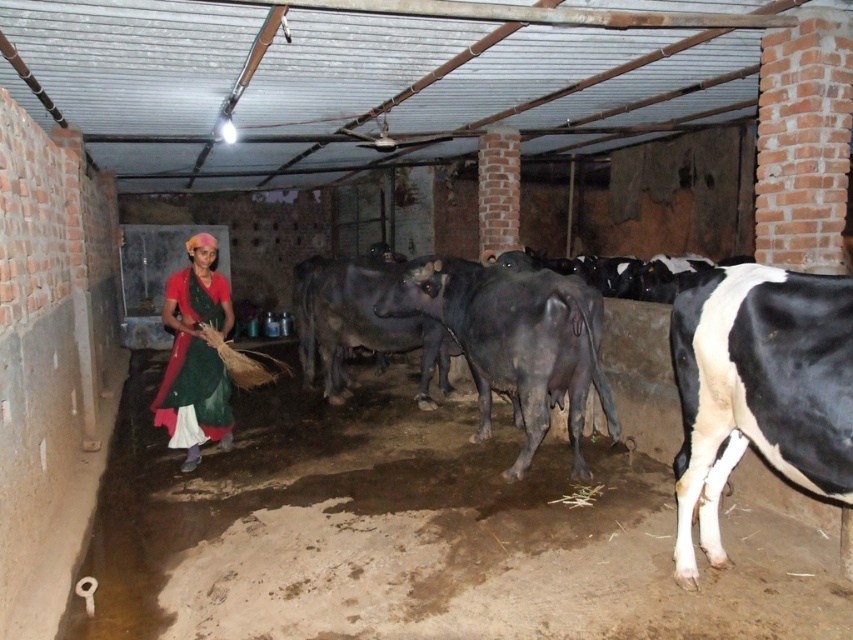
Question: In this image, where is shiny black cow at center located relative to matte red dress at center?

Choices:
 (A) right
 (B) left

Answer: (A)

Question: Does shiny black cow at center have a larger size compared to matte red dress at center?

Choices:
 (A) no
 (B) yes

Answer: (B)

Question: Which object appears farthest from the camera in this image?

Choices:
 (A) matte red dress at center
 (B) shiny black cow at center

Answer: (A)

Question: Is shiny black cow at center closer to camera compared to matte red dress at center?

Choices:
 (A) no
 (B) yes

Answer: (B)